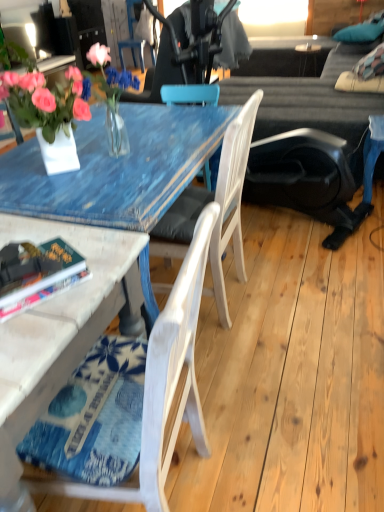
Where is `free point behind hardcover book at lower left`? The image size is (384, 512). free point behind hardcover book at lower left is located at coordinates (64, 233).